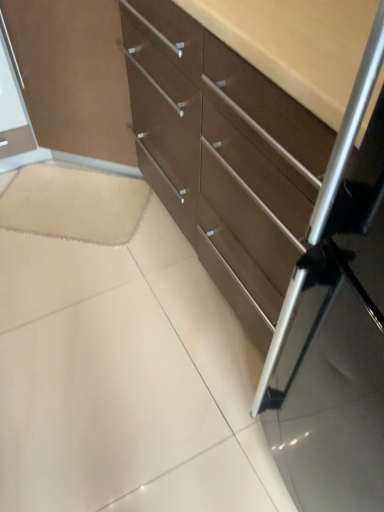
Identify the location of vacant region above beige soft carpet at lower left (from a real-world perspective). The height and width of the screenshot is (512, 384). (70, 200).